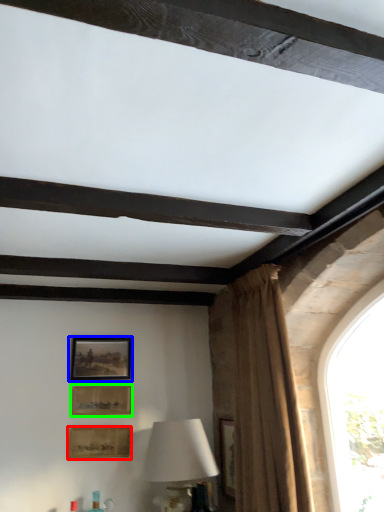
Question: Estimate the real-world distances between objects in this image. Which object is farther from picture frame (highlighted by a red box), picture frame (highlighted by a blue box) or picture frame (highlighted by a green box)?

Choices:
 (A) picture frame
 (B) picture frame

Answer: (A)